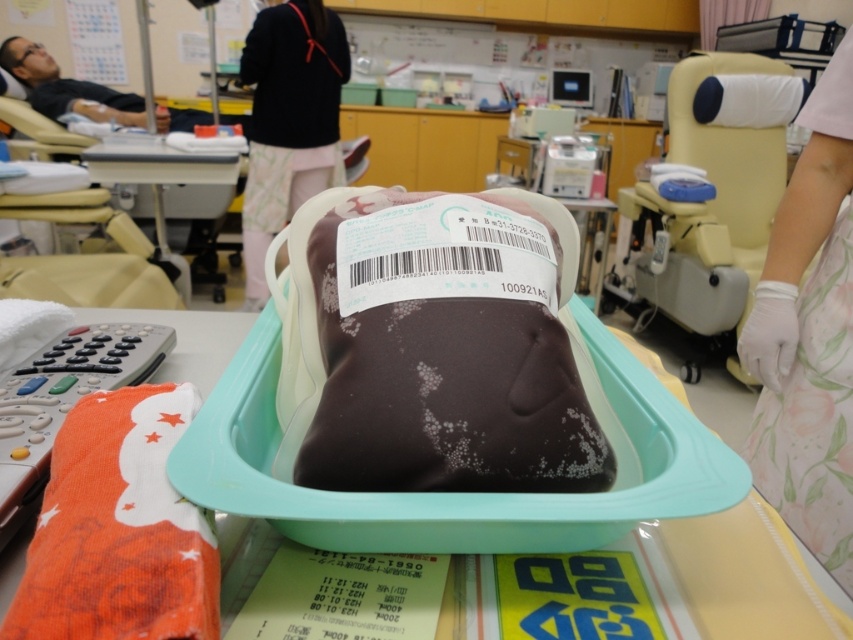
Looking at this image, measure the distance from beige plastic chair at upper right to matte black person at upper left.

beige plastic chair at upper right and matte black person at upper left are 8.47 feet apart from each other.

Is point (751, 276) behind point (165, 118)?

No, (751, 276) is in front of (165, 118).

You are a GUI agent. You are given a task and a screenshot of the screen. Output one action in this format:
    pyautogui.click(x=<x>, y=<y>)
    Task: Click on the beige plastic chair at upper right
    This screenshot has height=640, width=853.
    Given the screenshot: What is the action you would take?
    pyautogui.click(x=706, y=202)

Does beige plastic chair at upper right appear on the right side of black fabric at upper center?

Correct, you'll find beige plastic chair at upper right to the right of black fabric at upper center.

Image resolution: width=853 pixels, height=640 pixels. What do you see at coordinates (706, 202) in the screenshot?
I see `beige plastic chair at upper right` at bounding box center [706, 202].

The image size is (853, 640). What do you see at coordinates (706, 202) in the screenshot? I see `beige plastic chair at upper right` at bounding box center [706, 202].

Locate an element on the screen. beige plastic chair at upper right is located at coordinates (706, 202).

Is point (790, 76) closer to viewer compared to point (102, 362)?

No, (790, 76) is further to viewer.

Locate an element on the screen. The width and height of the screenshot is (853, 640). beige plastic chair at upper right is located at coordinates (706, 202).